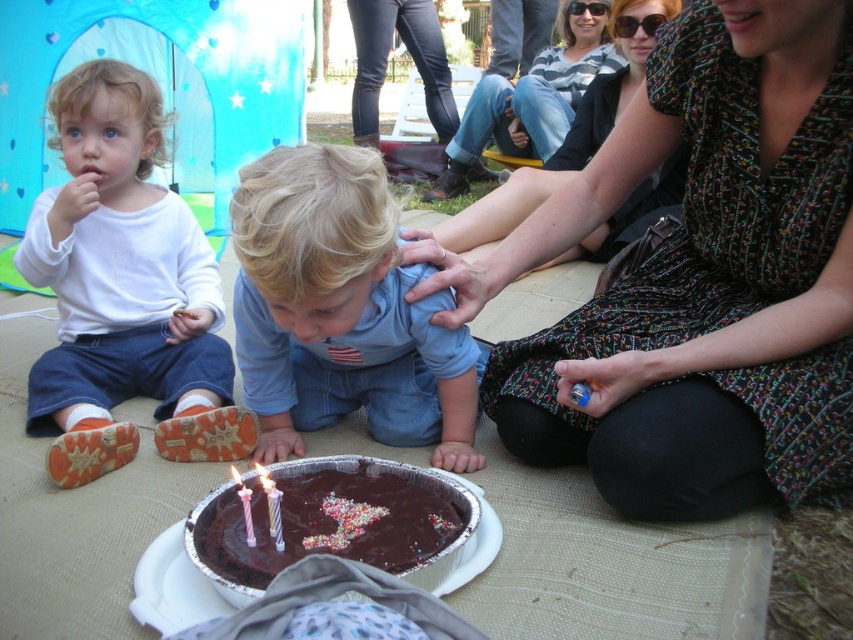
Question: Is white soft fabric shirt at upper left bigger than blue denim jeans at center?

Choices:
 (A) no
 (B) yes

Answer: (B)

Question: Is white soft fabric shirt at upper left in front of chocolatesmoothcake at lower center?

Choices:
 (A) no
 (B) yes

Answer: (A)

Question: Can you confirm if white soft fabric shirt at upper left is smaller than chocolatesmoothcake at lower center?

Choices:
 (A) no
 (B) yes

Answer: (A)

Question: Which point is closer to the camera?

Choices:
 (A) (599, 323)
 (B) (430, 401)

Answer: (A)

Question: Among these objects, which one is farthest from the camera?

Choices:
 (A) chocolatesmoothcake at lower center
 (B) white soft fabric shirt at upper left
 (C) pastel striped candle at center
 (D) translucent plastic candle at center

Answer: (B)

Question: Which point is closer to the camera?

Choices:
 (A) (451, 444)
 (B) (219, 445)
 (C) (263, 572)
 (D) (691, 12)

Answer: (C)